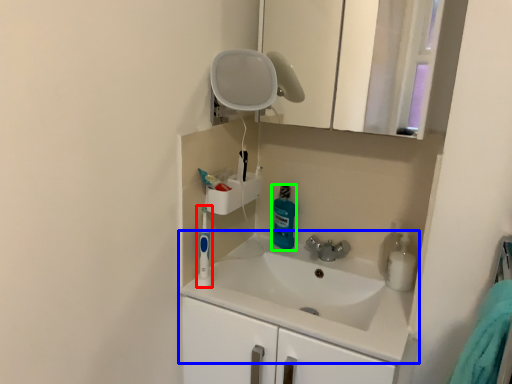
Question: Which is farther away from toiletry (highlighted by a red box)? sink (highlighted by a blue box) or cleaning product (highlighted by a green box)?

Choices:
 (A) sink
 (B) cleaning product

Answer: (B)